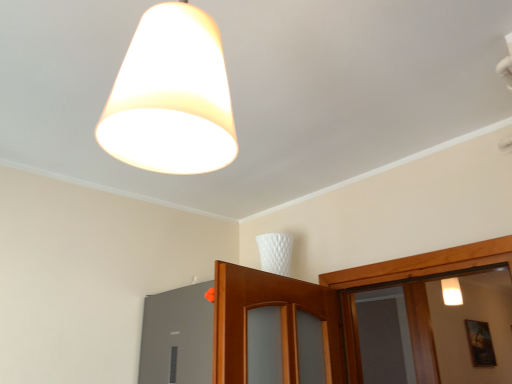
Measure the distance between wooden framed picture at lower right and camera.

wooden framed picture at lower right is 14.13 feet from camera.

Find the location of `white matte lampshade at upper center`. white matte lampshade at upper center is located at coordinates (170, 96).

Is matte gray window at lower left closer to the viewer compared to wooden framed picture at lower right?

That is True.

From the image's perspective, is matte gray window at lower left below wooden framed picture at lower right?

No, from the image's perspective, matte gray window at lower left is not beneath wooden framed picture at lower right.

In the scene shown: Considering the sizes of objects matte gray window at lower left and wooden framed picture at lower right in the image provided, who is bigger, matte gray window at lower left or wooden framed picture at lower right?

wooden framed picture at lower right is bigger.

Is matte gray window at lower left inside or outside of wooden framed picture at lower right?

The correct answer is: outside.

This screenshot has width=512, height=384. I want to click on window that appears on the left of white matte lampshade at upper center, so click(x=177, y=336).

From the picture: Can you confirm if matte gray window at lower left is wider than white matte lampshade at upper center?

No, matte gray window at lower left is not wider than white matte lampshade at upper center.

Is matte gray window at lower left taller or shorter than white matte lampshade at upper center?

matte gray window at lower left is shorter than white matte lampshade at upper center.

Is matte gray window at lower left to the left of white matte lampshade at upper center from the viewer's perspective?

Indeed, matte gray window at lower left is positioned on the left side of white matte lampshade at upper center.

From the picture: How different are the orientations of white matte lampshade at upper center and wooden framed picture at lower right in degrees?

The angle between the facing direction of white matte lampshade at upper center and the facing direction of wooden framed picture at lower right is 10.7 degrees.

From the image's perspective, which one is positioned lower, white matte lampshade at upper center or wooden framed picture at lower right?

wooden framed picture at lower right.

From a real-world perspective, who is located lower, white matte lampshade at upper center or wooden framed picture at lower right?

wooden framed picture at lower right, from a real-world perspective.

Is white matte lampshade at upper center not close to wooden framed picture at lower right?

Yes, white matte lampshade at upper center and wooden framed picture at lower right are located far from each other.

From a real-world perspective, is wooden framed picture at lower right positioned over white matte lampshade at upper center based on gravity?

No.

Considering the relative positions of wooden framed picture at lower right and white matte lampshade at upper center in the image provided, is wooden framed picture at lower right behind white matte lampshade at upper center?

Yes.

Are wooden framed picture at lower right and white matte lampshade at upper center located far from each other?

Yes, wooden framed picture at lower right and white matte lampshade at upper center are quite far apart.

You are a GUI agent. You are given a task and a screenshot of the screen. Output one action in this format:
    pyautogui.click(x=<x>, y=<y>)
    Task: Click on the picture frame behind the white matte lampshade at upper center
    This screenshot has width=512, height=384.
    Given the screenshot: What is the action you would take?
    pyautogui.click(x=480, y=343)

Image resolution: width=512 pixels, height=384 pixels. In order to click on window beneath the wooden framed picture at lower right (from a real-world perspective) in this screenshot , I will do `click(177, 336)`.

Is wooden framed picture at lower right positioned beyond the bounds of matte gray window at lower left?

That's correct, wooden framed picture at lower right is outside of matte gray window at lower left.

Considering the relative sizes of wooden framed picture at lower right and matte gray window at lower left in the image provided, is wooden framed picture at lower right shorter than matte gray window at lower left?

No, wooden framed picture at lower right is not shorter than matte gray window at lower left.

Which object is wider, wooden framed picture at lower right or matte gray window at lower left?

With larger width is wooden framed picture at lower right.

Is white matte lampshade at upper center positioned far away from matte gray window at lower left?

Indeed, white matte lampshade at upper center is not near matte gray window at lower left.

Considering the sizes of objects white matte lampshade at upper center and matte gray window at lower left in the image provided, who is bigger, white matte lampshade at upper center or matte gray window at lower left?

white matte lampshade at upper center is bigger.

Is white matte lampshade at upper center facing towards matte gray window at lower left?

No, white matte lampshade at upper center is not oriented towards matte gray window at lower left.

What are the coordinates of `picture frame behind the matte gray window at lower left` in the screenshot? It's located at (480, 343).

What are the coordinates of `lamp located above the matte gray window at lower left (from the image's perspective)` in the screenshot? It's located at 170,96.

From the image, which object appears to be farther from matte gray window at lower left, wooden framed picture at lower right or white matte lampshade at upper center?

wooden framed picture at lower right is positioned further to the anchor matte gray window at lower left.

Looking at this image, estimate the real-world distances between objects in this image. Which object is closer to matte gray window at lower left, white matte lampshade at upper center or wooden framed picture at lower right?

Among the two, white matte lampshade at upper center is located nearer to matte gray window at lower left.

Looking at the image, which one is located closer to wooden framed picture at lower right, white matte lampshade at upper center or matte gray window at lower left?

matte gray window at lower left is positioned closer to the anchor wooden framed picture at lower right.

Based on their spatial positions, is matte gray window at lower left or white matte lampshade at upper center closer to wooden framed picture at lower right?

Among the two, matte gray window at lower left is located nearer to wooden framed picture at lower right.

Considering their positions, is matte gray window at lower left positioned further to white matte lampshade at upper center than wooden framed picture at lower right?

wooden framed picture at lower right.

Based on their spatial positions, is wooden framed picture at lower right or matte gray window at lower left closer to white matte lampshade at upper center?

matte gray window at lower left lies closer to white matte lampshade at upper center than the other object.

At what (x,y) coordinates should I click in order to perform the action: click on window between white matte lampshade at upper center and wooden framed picture at lower right in the front-back direction. Please return your answer as a coordinate pair (x, y). Looking at the image, I should click on (177, 336).